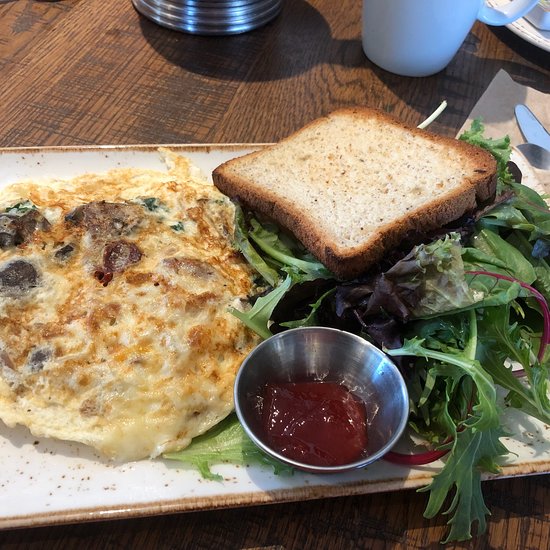
You are a GUI agent. You are given a task and a screenshot of the screen. Output one action in this format:
    pyautogui.click(x=<x>, y=<y>)
    Task: Click on the table top
    Image resolution: width=550 pixels, height=550 pixels.
    Given the screenshot: What is the action you would take?
    pyautogui.click(x=144, y=114)